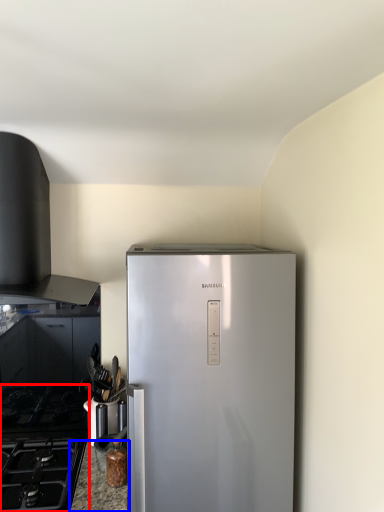
Question: Which of the following is the closest to the observer, gas stove (highlighted by a red box) or counter top (highlighted by a blue box)?

Choices:
 (A) gas stove
 (B) counter top

Answer: (A)